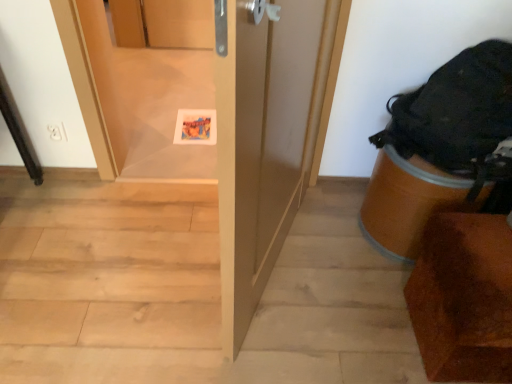
I want to click on light wood stairwell at center, so click(189, 291).

What is the approximate height of brown wood chair at lower right?

brown wood chair at lower right is 15.77 inches in height.

This screenshot has height=384, width=512. I want to click on matte paper postcard at center, so [x=196, y=127].

Where is `postcard that is above the brown wood chair at lower right (from the image's perspective)`? The image size is (512, 384). postcard that is above the brown wood chair at lower right (from the image's perspective) is located at coordinates (196, 127).

Would you say matte paper postcard at center is inside or outside brown wood chair at lower right?

The correct answer is: outside.

Is point (216, 130) closer to viewer compared to point (462, 251)?

Yes, point (216, 130) is closer to viewer.

Who is bigger, matte paper postcard at center or brown wood chair at lower right?

With larger size is brown wood chair at lower right.

Which object is closer to the camera, transparent plastic screen door at center or brown wood chair at lower right?

brown wood chair at lower right is in front.

From a real-world perspective, is transparent plastic screen door at center positioned above or below brown wood chair at lower right?

transparent plastic screen door at center is above brown wood chair at lower right.

Is transparent plastic screen door at center aimed at brown wood chair at lower right?

No, transparent plastic screen door at center is not turned towards brown wood chair at lower right.

Is light wood stairwell at center taller or shorter than brown wood chair at lower right?

Clearly, light wood stairwell at center is shorter compared to brown wood chair at lower right.

Which point is more distant from viewer, (48, 353) or (478, 353)?

Answer: The point (48, 353) is farther.

I want to click on stairwell located above the brown wood chair at lower right (from the image's perspective), so click(x=189, y=291).

Which is more to the left, light wood stairwell at center or brown wood chair at lower right?

Positioned to the left is light wood stairwell at center.

Does light wood stairwell at center appear on the left side of matte paper postcard at center?

Incorrect, light wood stairwell at center is not on the left side of matte paper postcard at center.

Where is `postcard on the left of light wood stairwell at center`? This screenshot has width=512, height=384. postcard on the left of light wood stairwell at center is located at coordinates (196, 127).

Does point (10, 208) lie behind point (213, 119)?

That is False.

From a real-world perspective, is light wood stairwell at center beneath matte paper postcard at center?

Indeed, from a real-world perspective, light wood stairwell at center is positioned beneath matte paper postcard at center.

Is brown wood chair at lower right further to the viewer compared to matte paper postcard at center?

That is False.

Looking at this image, is brown wood chair at lower right taller or shorter than matte paper postcard at center?

In the image, brown wood chair at lower right appears to be taller than matte paper postcard at center.

Would you say brown wood chair at lower right is inside or outside matte paper postcard at center?

brown wood chair at lower right is not inside matte paper postcard at center, it's outside.

Is matte paper postcard at center at the back of brown wood chair at lower right?

No, brown wood chair at lower right is not facing away from matte paper postcard at center.

Is matte paper postcard at center positioned with its back to light wood stairwell at center?

No, matte paper postcard at center is not facing the opposite direction of light wood stairwell at center.

From a real-world perspective, is matte paper postcard at center located higher than light wood stairwell at center?

Yes.

Where is `postcard on the left of transparent plastic screen door at center`? postcard on the left of transparent plastic screen door at center is located at coordinates (196, 127).

Would you say transparent plastic screen door at center is inside or outside matte paper postcard at center?

transparent plastic screen door at center lies outside matte paper postcard at center.

Is transparent plastic screen door at center wider than matte paper postcard at center?

Yes.

Between transparent plastic screen door at center and matte paper postcard at center, which one is positioned behind?

matte paper postcard at center is behind.

Where is `postcard that appears below the brown wood chair at lower right (from a real-world perspective)`? The width and height of the screenshot is (512, 384). postcard that appears below the brown wood chair at lower right (from a real-world perspective) is located at coordinates (196, 127).

Locate an element on the screen. screen door on the left side of brown wood chair at lower right is located at coordinates (152, 81).

Estimate the real-world distances between objects in this image. Which object is further from brown wood chair at lower right, matte paper postcard at center or black fabric backpack at right?

Among the two, matte paper postcard at center is located further to brown wood chair at lower right.

Considering their positions, is matte paper postcard at center positioned further to light wood stairwell at center than transparent plastic screen door at center?

Among the two, matte paper postcard at center is located further to light wood stairwell at center.

Looking at the image, which one is located closer to transparent plastic screen door at center, matte paper postcard at center or brown wood chair at lower right?

matte paper postcard at center is positioned closer to the anchor transparent plastic screen door at center.

Looking at the image, which one is located further to matte paper postcard at center, transparent plastic screen door at center or black fabric backpack at right?

black fabric backpack at right is positioned further to the anchor matte paper postcard at center.

Which object lies nearer to the anchor point brown wood chair at lower right, light wood stairwell at center or black fabric backpack at right?

The object closer to brown wood chair at lower right is black fabric backpack at right.

Based on their spatial positions, is black fabric backpack at right or light wood stairwell at center further from brown wood chair at lower right?

The object further to brown wood chair at lower right is light wood stairwell at center.

Considering their positions, is transparent plastic screen door at center positioned closer to black fabric backpack at right than brown wood chair at lower right?

brown wood chair at lower right lies closer to black fabric backpack at right than the other object.

When comparing their distances from light wood stairwell at center, does matte paper postcard at center or brown wood chair at lower right seem further?

The object further to light wood stairwell at center is matte paper postcard at center.

Locate an element on the screen. The image size is (512, 384). screen door between light wood stairwell at center and matte paper postcard at center in the front-back direction is located at coordinates (152, 81).

Where is `screen door between brown wood chair at lower right and matte paper postcard at center along the z-axis`? screen door between brown wood chair at lower right and matte paper postcard at center along the z-axis is located at coordinates (152, 81).

In order to click on backpack between light wood stairwell at center and brown wood chair at lower right in the horizontal direction in this screenshot , I will do `click(458, 114)`.

At what (x,y) coordinates should I click in order to perform the action: click on stairwell situated between transparent plastic screen door at center and brown wood chair at lower right from left to right. Please return your answer as a coordinate pair (x, y). Looking at the image, I should click on (189, 291).